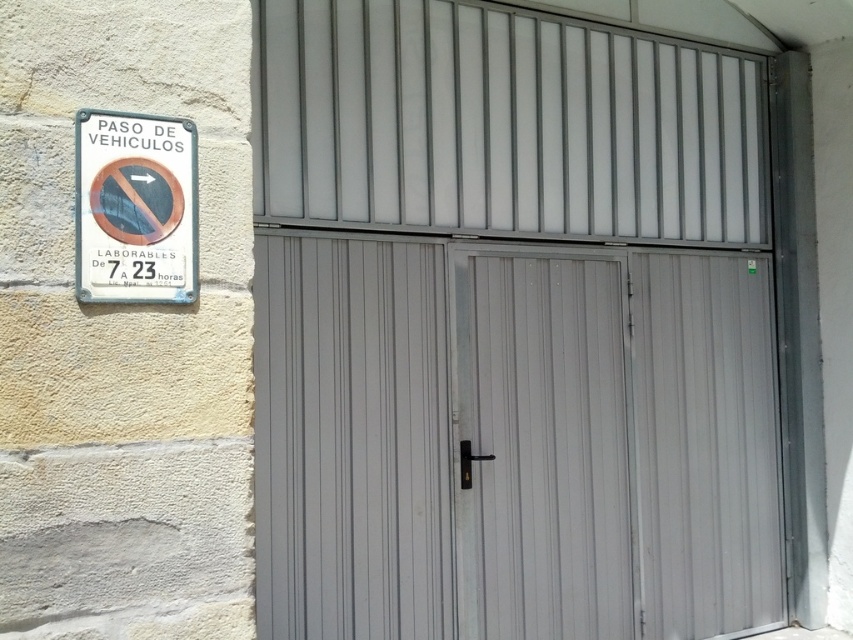
Can you confirm if metallic gray door at center is shorter than white matte door at center?

No.

Which is behind, point (566, 582) or point (608, 524)?

The point (608, 524) is more distant.

Who is more forward, [502,536] or [494,451]?

Point [502,536] is in front.

I want to click on metallic gray door at center, so click(514, 440).

Is metallic gray door at center positioned before white metal sign at upper left?

No.

Does point (334, 595) lie in front of point (120, 154)?

No, (334, 595) is behind (120, 154).

Is point (677, 260) positioned before point (161, 230)?

No, (677, 260) is behind (161, 230).

Image resolution: width=853 pixels, height=640 pixels. Identify the location of metallic gray door at center. (514, 440).

Does white matte door at center have a smaller size compared to white metal sign at upper left?

No, white matte door at center is not smaller than white metal sign at upper left.

Does white matte door at center appear on the left side of white metal sign at upper left?

In fact, white matte door at center is to the right of white metal sign at upper left.

The height and width of the screenshot is (640, 853). Find the location of `white matte door at center`. white matte door at center is located at coordinates (543, 445).

Where is `white matte door at center`? The height and width of the screenshot is (640, 853). white matte door at center is located at coordinates (543, 445).